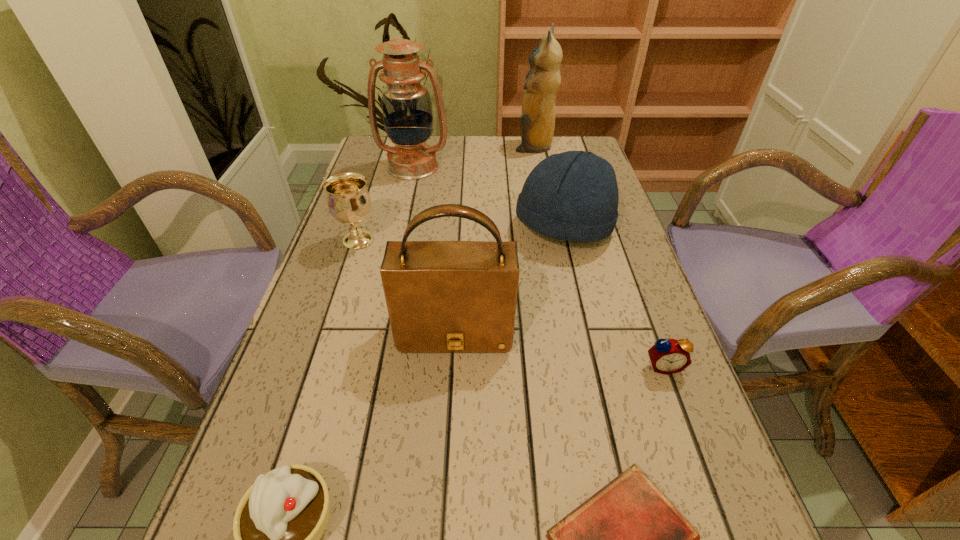
Identify which object is located as the second nearest to the farthest object. Please provide its 2D coordinates. Your answer should be formatted as a tuple, i.e. [(x, y)], where the tuple contains the x and y coordinates of a point satisfying the conditions above.

[(573, 196)]

Where is `the fifth closest object to the cat`? This screenshot has width=960, height=540. the fifth closest object to the cat is located at coordinates (667, 356).

In order to click on vacant region that satisfies the following two spatial constraints: 1. on the face of the cat; 2. on the front side of the oil lamp in this screenshot , I will do `click(538, 166)`.

In order to click on vacant region that satisfies the following two spatial constraints: 1. on the face of the farthest object; 2. on the front side of the oil lamp in this screenshot , I will do `click(538, 166)`.